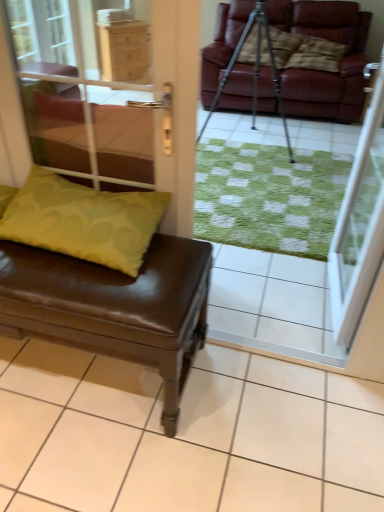
Question: Can you confirm if metallic tripod at center is positioned to the left of green fabric cushion at lower left, positioned as the 1th screen door in left-to-right order?

Choices:
 (A) no
 (B) yes

Answer: (A)

Question: Could you tell me if metallic tripod at center is facing green fabric cushion at lower left, the second screen door in the right-to-left sequence?

Choices:
 (A) yes
 (B) no

Answer: (A)

Question: Is there a large distance between metallic tripod at center and green fabric cushion at lower left, positioned as the 1th screen door in left-to-right order?

Choices:
 (A) no
 (B) yes

Answer: (B)

Question: From a real-world perspective, is metallic tripod at center physically below green fabric cushion at lower left, the second screen door in the right-to-left sequence?

Choices:
 (A) yes
 (B) no

Answer: (A)

Question: From a real-world perspective, does metallic tripod at center stand above green fabric cushion at lower left, positioned as the 1th screen door in left-to-right order?

Choices:
 (A) yes
 (B) no

Answer: (B)

Question: Are metallic tripod at center and green fabric cushion at lower left, positioned as the 1th screen door in left-to-right order, making contact?

Choices:
 (A) no
 (B) yes

Answer: (A)

Question: From a real-world perspective, is metallic tripod at center physically above brown leather bench at lower left?

Choices:
 (A) yes
 (B) no

Answer: (A)

Question: Are metallic tripod at center and brown leather bench at lower left beside each other?

Choices:
 (A) yes
 (B) no

Answer: (B)

Question: Does metallic tripod at center appear on the left side of brown leather bench at lower left?

Choices:
 (A) no
 (B) yes

Answer: (A)

Question: Does metallic tripod at center have a greater width compared to brown leather bench at lower left?

Choices:
 (A) no
 (B) yes

Answer: (B)

Question: Considering the relative positions of metallic tripod at center and brown leather bench at lower left in the image provided, is metallic tripod at center in front of brown leather bench at lower left?

Choices:
 (A) no
 (B) yes

Answer: (A)

Question: Can you confirm if metallic tripod at center is thinner than brown leather bench at lower left?

Choices:
 (A) no
 (B) yes

Answer: (A)

Question: Would you consider brown leather bench at lower left to be distant from metallic tripod at center?

Choices:
 (A) no
 (B) yes

Answer: (B)